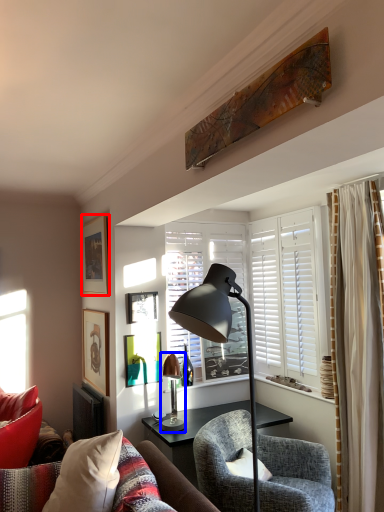
Question: Among these objects, which one is nearest to the camera, picture frame (highlighted by a red box) or lamp (highlighted by a blue box)?

Choices:
 (A) picture frame
 (B) lamp

Answer: (B)